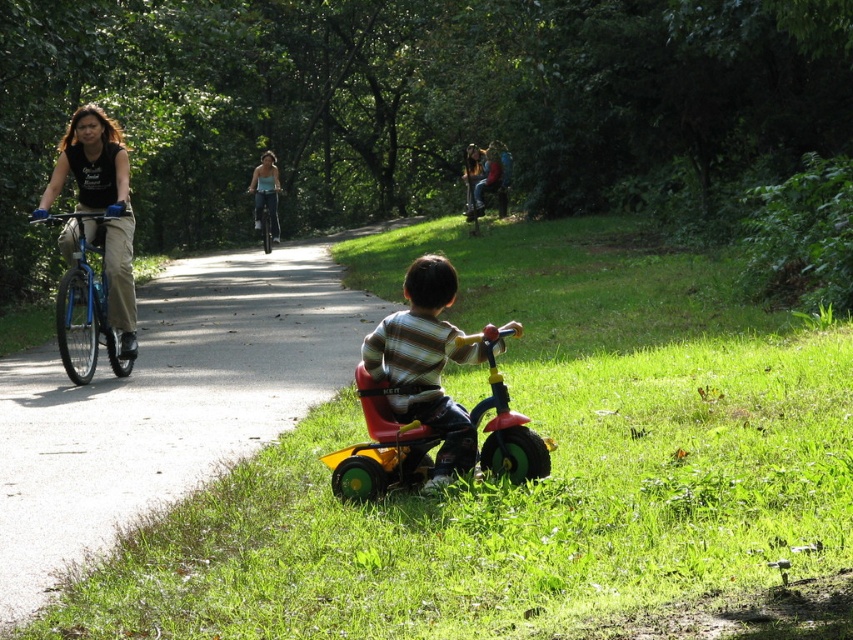
Question: Which of the following is the closest to the observer?

Choices:
 (A) yellow plastic tricycle at lower center
 (B) blue metallic bicycle at left
 (C) matte plastic tricycle at lower center
 (D) blue metallic bicycle at center

Answer: (A)

Question: Based on their relative distances, which object is farther from the blue metallic bicycle at left?

Choices:
 (A) blue metallic bicycle at center
 (B) matte plastic tricycle at lower center
 (C) yellow plastic tricycle at lower center

Answer: (A)

Question: Does yellow plastic tricycle at lower center have a greater width compared to blue metallic bicycle at left?

Choices:
 (A) no
 (B) yes

Answer: (B)

Question: Which point is farther to the camera?

Choices:
 (A) (384, 358)
 (B) (267, 208)
 (C) (97, 308)
 (D) (248, 330)

Answer: (B)

Question: Can you confirm if blue metallic bicycle at left is wider than blue metallic bicycle at center?

Choices:
 (A) yes
 (B) no

Answer: (A)

Question: From the image, what is the correct spatial relationship of yellow plastic tricycle at lower center in relation to blue metallic bicycle at left?

Choices:
 (A) right
 (B) left

Answer: (A)